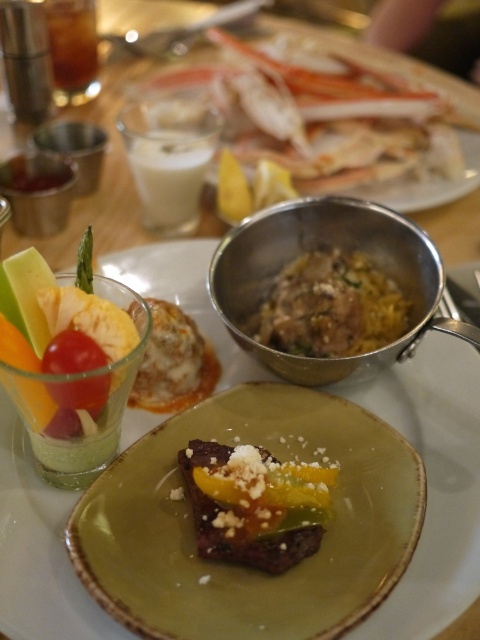
From the picture: You are a diner sitting at the table and want to reach for the crab legs at upper center and the brown translucent glass at upper left. Which object is closer to your left side?

The brown translucent glass at upper left is closer to your left side because it is positioned to the left of the crab legs at upper center.

You are a waiter trying to place a new dish on the dining table. The table has limited space, and you need to ensure that the new dish will fit between the green matte plate at center and the yellow rice at center. Which object should you consider the width of to determine if there is enough space?

The green matte plate at center has a larger width than the yellow rice at center, so you should consider the width of the green matte plate at center to determine if there is enough space.

From the picture: You are a diner looking at the dining table setup. You see the yellow rice at center and the saucy bread at center. Which dish is positioned higher on the table?

The yellow rice at center is located above the saucy bread at center, so the yellow rice at center is positioned higher on the table.